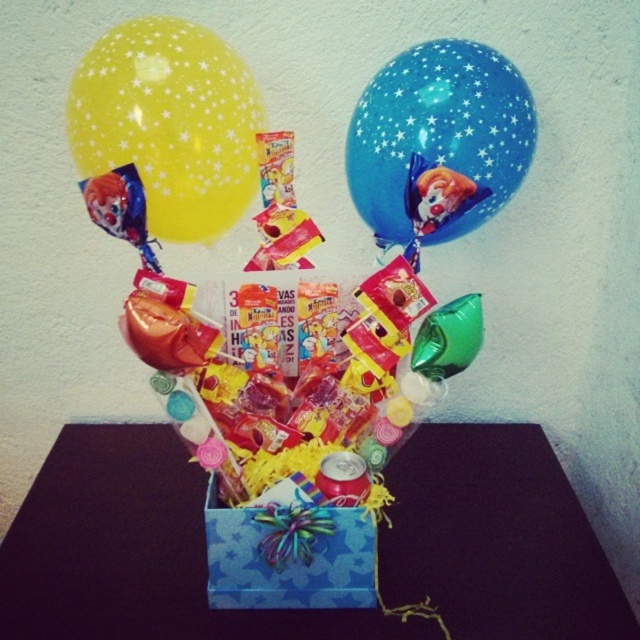
Find the location of `blue cardboard box at center`. blue cardboard box at center is located at coordinates (136, 552).

Which of these two, blue cardboard box at center or yellow star-patterned balloon at upper left, stands taller?

yellow star-patterned balloon at upper left is taller.

Is point (422, 557) positioned after point (200, 198)?

Yes.

At what (x,y) coordinates should I click in order to perform the action: click on blue cardboard box at center. Please return your answer as a coordinate pair (x, y). Image resolution: width=640 pixels, height=640 pixels. Looking at the image, I should click on (136, 552).

Where is `yellow star-patterned balloon at upper left`? yellow star-patterned balloon at upper left is located at coordinates (170, 124).

Between yellow star-patterned balloon at upper left and metallic clown balloon at upper left, which one has more height?

Standing taller between the two is yellow star-patterned balloon at upper left.

Where is `yellow star-patterned balloon at upper left`? This screenshot has width=640, height=640. yellow star-patterned balloon at upper left is located at coordinates (170, 124).

Who is taller, metallic clown balloon at upper left or matte clown balloon at upper center?

metallic clown balloon at upper left

Does metallic clown balloon at upper left appear on the left side of matte clown balloon at upper center?

Indeed, metallic clown balloon at upper left is positioned on the left side of matte clown balloon at upper center.

Measure the distance between point (116, 179) and camera.

A distance of 83.07 centimeters exists between point (116, 179) and camera.

Identify the location of metallic clown balloon at upper left. The image size is (640, 640). pyautogui.click(x=120, y=209).